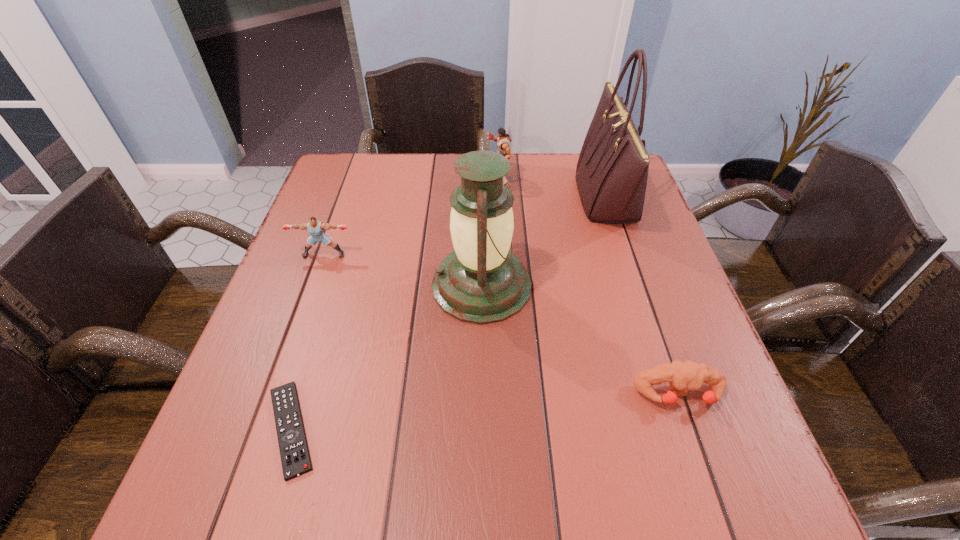
Identify the location of vacant space situated on the front-facing side of the handbag. The height and width of the screenshot is (540, 960). (505, 197).

Identify the location of free space located on the front-facing side of the handbag. The image size is (960, 540). (531, 197).

The image size is (960, 540). Identify the location of vacant space located 0.200m with the light compartment facing forward on the second tallest object. (341, 285).

The height and width of the screenshot is (540, 960). Find the location of `vacant space located with the light compartment facing forward on the second tallest object`. vacant space located with the light compartment facing forward on the second tallest object is located at coordinates (341, 285).

Image resolution: width=960 pixels, height=540 pixels. I want to click on vacant space located with the light compartment facing forward on the second tallest object, so click(x=305, y=285).

This screenshot has height=540, width=960. Identify the location of vacant area situated on the front-facing side of the second puncher from left to right. (392, 180).

The height and width of the screenshot is (540, 960). What are the coordinates of `vacant space located on the front-facing side of the second puncher from left to right` in the screenshot? It's located at (368, 180).

Where is `free space located 0.100m on the front-facing side of the second puncher from left to right`? This screenshot has height=540, width=960. free space located 0.100m on the front-facing side of the second puncher from left to right is located at coordinates (451, 180).

Where is `vacant space located 0.140m on the front-facing side of the fourth tallest object`? vacant space located 0.140m on the front-facing side of the fourth tallest object is located at coordinates (306, 305).

This screenshot has width=960, height=540. In order to click on free space located with the gloves of the shortest puncher facing forward in this screenshot , I will do `click(710, 485)`.